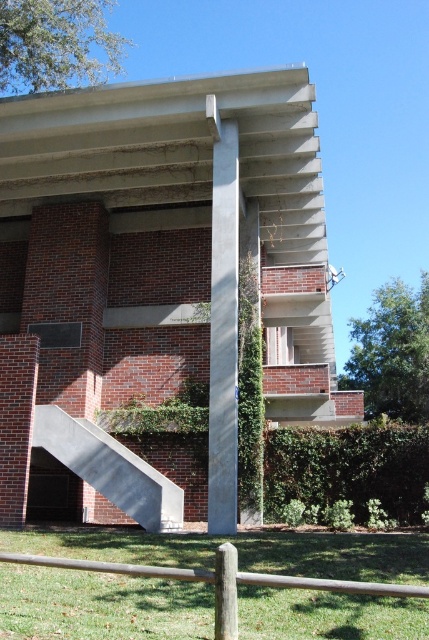
You are standing at the base of the building and looking up at the two points marked on the facade. Which point, point (407,592) or point (217,593), appears closer to you?

Point (407,592) is in front of point (217,593), so it appears closer to you.